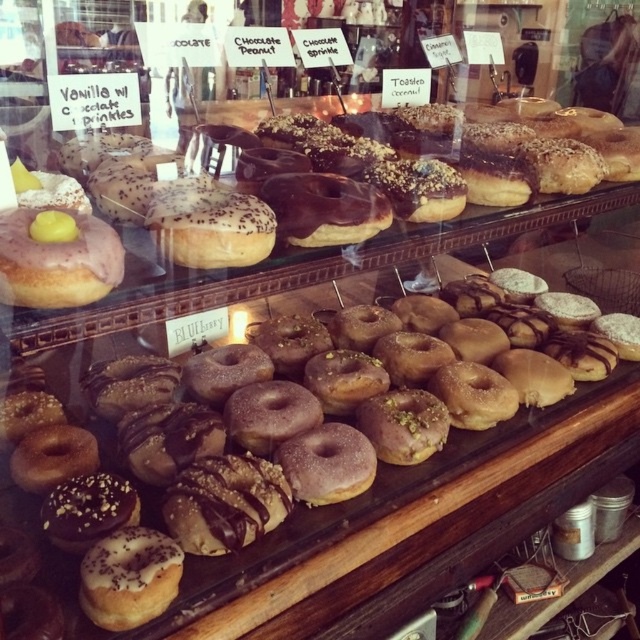
You are a customer looking at the display case and want to choose between the chocolate glaze donut at center and the matte pink glazed donut at left. Which one is positioned lower in the display case?

The chocolate glaze donut at center is positioned below the matte pink glazed donut at left, so it is lower in the display case.

You are a customer at the donut shop and want to choose between the chocolate glaze donut at center and the matte pink glazed donut at left. Which one is wider?

The chocolate glaze donut at center is wider than the matte pink glazed donut at left.

You are a customer looking at the display case and want to order the matte white glazed donut at left and the matte pink glazed donut at left. Which one is positioned to the right of the other?

The matte white glazed donut at left is positioned to the right of the matte pink glazed donut at left.